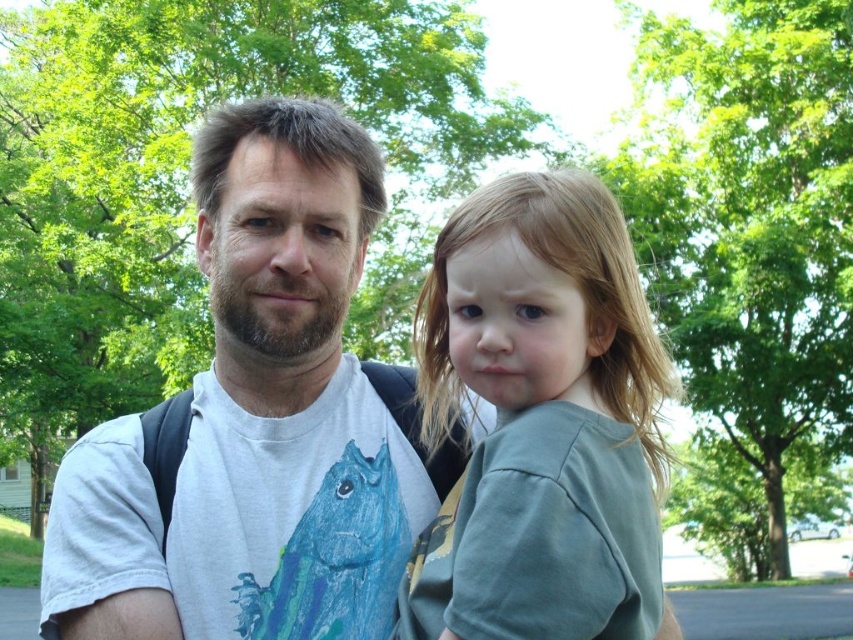
Question: Is white t-shirt at center further to camera compared to light brown hair at right?

Choices:
 (A) yes
 (B) no

Answer: (A)

Question: Which point is farther from the camera taking this photo?

Choices:
 (A) (74, 486)
 (B) (532, 508)

Answer: (A)

Question: Does white t-shirt at center come behind light brown hair at right?

Choices:
 (A) yes
 (B) no

Answer: (A)

Question: Is white t-shirt at center positioned behind light brown hair at right?

Choices:
 (A) no
 (B) yes

Answer: (B)

Question: Among these points, which one is nearest to the camera?

Choices:
 (A) (477, 577)
 (B) (273, 348)

Answer: (A)